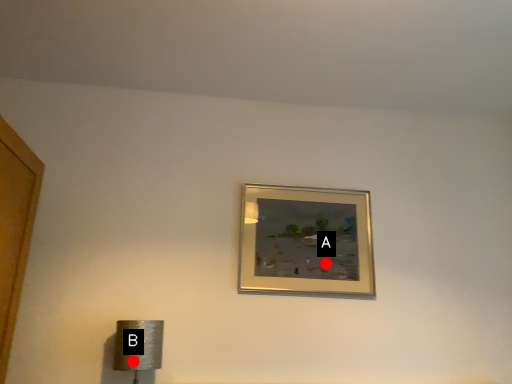
Question: Two points are circled on the image, labeled by A and B beside each circle. Which point is closer to the camera taking this photo?

Choices:
 (A) A is closer
 (B) B is closer

Answer: (B)